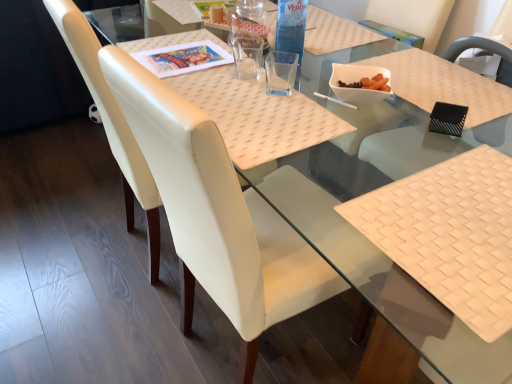
Question: Can you confirm if black mesh chair at upper right, the 3th chair in the left-to-right sequence, is thinner than white woven placemat at lower right?

Choices:
 (A) no
 (B) yes

Answer: (A)

Question: Is black mesh chair at upper right, the 3th chair in the left-to-right sequence, positioned in front of white woven placemat at lower right?

Choices:
 (A) no
 (B) yes

Answer: (A)

Question: From a real-world perspective, is black mesh chair at upper right, the 3th chair in the left-to-right sequence, under white woven placemat at lower right?

Choices:
 (A) yes
 (B) no

Answer: (B)

Question: Is black mesh chair at upper right, marked as the first chair in a right-to-left arrangement, taller than white woven placemat at lower right?

Choices:
 (A) no
 (B) yes

Answer: (A)

Question: Is black mesh chair at upper right, the 3th chair in the left-to-right sequence, placed right next to white woven placemat at lower right?

Choices:
 (A) no
 (B) yes

Answer: (A)

Question: From the image's perspective, is black mesh chair at upper right, the 3th chair in the left-to-right sequence, over white woven placemat at lower right?

Choices:
 (A) no
 (B) yes

Answer: (B)

Question: Is transparent plastic bottle at upper center smaller than white woven placemat at lower right?

Choices:
 (A) no
 (B) yes

Answer: (B)

Question: Is the depth of transparent plastic bottle at upper center less than that of white woven placemat at lower right?

Choices:
 (A) yes
 (B) no

Answer: (B)

Question: Is white woven placemat at lower right a part of transparent plastic bottle at upper center?

Choices:
 (A) yes
 (B) no

Answer: (B)

Question: Is transparent plastic bottle at upper center bigger than white woven placemat at lower right?

Choices:
 (A) no
 (B) yes

Answer: (A)

Question: From a real-world perspective, is transparent plastic bottle at upper center physically above white woven placemat at lower right?

Choices:
 (A) no
 (B) yes

Answer: (B)

Question: Is transparent plastic bottle at upper center oriented towards white woven placemat at lower right?

Choices:
 (A) yes
 (B) no

Answer: (B)

Question: Does white woven placemat at lower right have a greater width compared to white leather chair at center, acting as the 2th chair starting from the right?

Choices:
 (A) yes
 (B) no

Answer: (B)